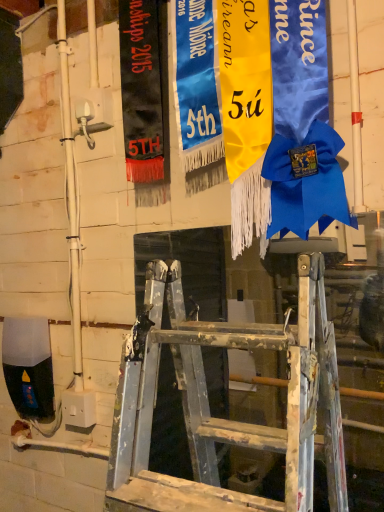
Identify the location of blue satin ribbon at upper center, marked as the 2th tapestry in a right-to-left arrangement. (197, 94).

Is blue satin ribbon at upper center, marked as the second tapestry in a left-to-right arrangement, oriented away from yellow satin ribbon at center, marked as the third tapestry in a left-to-right arrangement?

No.

Is blue satin ribbon at upper center, marked as the 2th tapestry in a right-to-left arrangement, inside the boundaries of yellow satin ribbon at center, which ranks as the first tapestry in right-to-left order, or outside?

blue satin ribbon at upper center, marked as the 2th tapestry in a right-to-left arrangement, is located beyond the bounds of yellow satin ribbon at center, which ranks as the first tapestry in right-to-left order.

From a real-world perspective, is blue satin ribbon at upper center, marked as the 2th tapestry in a right-to-left arrangement, physically below yellow satin ribbon at center, which ranks as the first tapestry in right-to-left order?

No, from a real-world perspective, blue satin ribbon at upper center, marked as the 2th tapestry in a right-to-left arrangement, is not below yellow satin ribbon at center, which ranks as the first tapestry in right-to-left order.

From the picture: From a real-world perspective, between yellow satin ribbon at center, marked as the third tapestry in a left-to-right arrangement, and blue satin ribbon at upper center, marked as the second tapestry in a left-to-right arrangement, who is vertically lower?

yellow satin ribbon at center, marked as the third tapestry in a left-to-right arrangement, is physically lower.

From the image's perspective, between yellow satin ribbon at center, which ranks as the first tapestry in right-to-left order, and blue satin ribbon at upper center, marked as the second tapestry in a left-to-right arrangement, which one is located above?

From the image's view, blue satin ribbon at upper center, marked as the second tapestry in a left-to-right arrangement, is above.

From their relative heights in the image, would you say yellow satin ribbon at center, marked as the third tapestry in a left-to-right arrangement, is taller or shorter than blue satin ribbon at upper center, marked as the second tapestry in a left-to-right arrangement?

Clearly, yellow satin ribbon at center, marked as the third tapestry in a left-to-right arrangement, is taller compared to blue satin ribbon at upper center, marked as the second tapestry in a left-to-right arrangement.

Is blue satin ribbon at upper center, marked as the second tapestry in a left-to-right arrangement, inside yellow satin ribbon at center, marked as the third tapestry in a left-to-right arrangement?

No, blue satin ribbon at upper center, marked as the second tapestry in a left-to-right arrangement, is not inside yellow satin ribbon at center, marked as the third tapestry in a left-to-right arrangement.

Can you confirm if black fabric banner at upper left, marked as the 1th tapestry in a left-to-right arrangement, is positioned to the right of blue satin ribbon at upper center, marked as the 2th tapestry in a right-to-left arrangement?

In fact, black fabric banner at upper left, marked as the 1th tapestry in a left-to-right arrangement, is to the left of blue satin ribbon at upper center, marked as the 2th tapestry in a right-to-left arrangement.

Which is further, (145, 6) or (213, 173)?

The point (213, 173) is behind.

Are black fabric banner at upper left, marked as the 1th tapestry in a left-to-right arrangement, and blue satin ribbon at upper center, marked as the second tapestry in a left-to-right arrangement, beside each other?

They are not placed beside each other.

Does yellow satin ribbon at center, which ranks as the first tapestry in right-to-left order, have a lesser width compared to black fabric banner at upper left, marked as the 1th tapestry in a left-to-right arrangement?

Incorrect, the width of yellow satin ribbon at center, which ranks as the first tapestry in right-to-left order, is not less than that of black fabric banner at upper left, marked as the 1th tapestry in a left-to-right arrangement.

From the image's perspective, which is above, yellow satin ribbon at center, which ranks as the first tapestry in right-to-left order, or black fabric banner at upper left, arranged as the 3th tapestry when viewed from the right?

black fabric banner at upper left, arranged as the 3th tapestry when viewed from the right.

In terms of height, does yellow satin ribbon at center, marked as the third tapestry in a left-to-right arrangement, look taller or shorter compared to black fabric banner at upper left, marked as the 1th tapestry in a left-to-right arrangement?

In the image, yellow satin ribbon at center, marked as the third tapestry in a left-to-right arrangement, appears to be taller than black fabric banner at upper left, marked as the 1th tapestry in a left-to-right arrangement.

Is blue satin ribbon at upper center, marked as the second tapestry in a left-to-right arrangement, looking in the opposite direction of black fabric banner at upper left, arranged as the 3th tapestry when viewed from the right?

No, blue satin ribbon at upper center, marked as the second tapestry in a left-to-right arrangement, is not facing away from black fabric banner at upper left, arranged as the 3th tapestry when viewed from the right.

In the image, is blue satin ribbon at upper center, marked as the 2th tapestry in a right-to-left arrangement, positioned in front of or behind black fabric banner at upper left, marked as the 1th tapestry in a left-to-right arrangement?

Clearly, blue satin ribbon at upper center, marked as the 2th tapestry in a right-to-left arrangement, is in front of black fabric banner at upper left, marked as the 1th tapestry in a left-to-right arrangement.

Is blue satin ribbon at upper center, marked as the second tapestry in a left-to-right arrangement, next to black fabric banner at upper left, arranged as the 3th tapestry when viewed from the right, and touching it?

They are not placed beside each other.

Does blue satin ribbon at upper center, marked as the second tapestry in a left-to-right arrangement, have a lesser width compared to black fabric banner at upper left, arranged as the 3th tapestry when viewed from the right?

No.

How much distance is there between black fabric banner at upper left, marked as the 1th tapestry in a left-to-right arrangement, and yellow satin ribbon at center, marked as the third tapestry in a left-to-right arrangement?

black fabric banner at upper left, marked as the 1th tapestry in a left-to-right arrangement, is 8.10 inches from yellow satin ribbon at center, marked as the third tapestry in a left-to-right arrangement.

Can you confirm if black fabric banner at upper left, marked as the 1th tapestry in a left-to-right arrangement, is taller than yellow satin ribbon at center, which ranks as the first tapestry in right-to-left order?

Incorrect, the height of black fabric banner at upper left, marked as the 1th tapestry in a left-to-right arrangement, is not larger of that of yellow satin ribbon at center, which ranks as the first tapestry in right-to-left order.

From the image's perspective, which is below, black fabric banner at upper left, arranged as the 3th tapestry when viewed from the right, or yellow satin ribbon at center, which ranks as the first tapestry in right-to-left order?

yellow satin ribbon at center, which ranks as the first tapestry in right-to-left order.

Consider the image. Is black fabric banner at upper left, marked as the 1th tapestry in a left-to-right arrangement, inside or outside of yellow satin ribbon at center, which ranks as the first tapestry in right-to-left order?

black fabric banner at upper left, marked as the 1th tapestry in a left-to-right arrangement, lies outside yellow satin ribbon at center, which ranks as the first tapestry in right-to-left order.

Find the location of a particular element. This screenshot has width=384, height=512. the 1st tapestry behind the yellow satin ribbon at center, marked as the third tapestry in a left-to-right arrangement is located at coordinates (197, 94).

Locate an element on the screen. the 1st tapestry positioned above the yellow satin ribbon at center, marked as the third tapestry in a left-to-right arrangement (from the image's perspective) is located at coordinates (197, 94).

From the image, which object appears to be nearer to blue satin ribbon at upper center, marked as the 2th tapestry in a right-to-left arrangement, black fabric banner at upper left, marked as the 1th tapestry in a left-to-right arrangement, or yellow satin ribbon at center, which ranks as the first tapestry in right-to-left order?

yellow satin ribbon at center, which ranks as the first tapestry in right-to-left order, lies closer to blue satin ribbon at upper center, marked as the 2th tapestry in a right-to-left arrangement, than the other object.

When comparing their distances from yellow satin ribbon at center, marked as the third tapestry in a left-to-right arrangement, does blue satin ribbon at upper center, marked as the second tapestry in a left-to-right arrangement, or black fabric banner at upper left, arranged as the 3th tapestry when viewed from the right, seem further?

black fabric banner at upper left, arranged as the 3th tapestry when viewed from the right.

Looking at this image, considering their positions, is yellow satin ribbon at center, which ranks as the first tapestry in right-to-left order, positioned further to black fabric banner at upper left, marked as the 1th tapestry in a left-to-right arrangement, than blue satin ribbon at upper center, marked as the second tapestry in a left-to-right arrangement?

yellow satin ribbon at center, which ranks as the first tapestry in right-to-left order, lies further to black fabric banner at upper left, marked as the 1th tapestry in a left-to-right arrangement, than the other object.

Looking at this image, based on their spatial positions, is yellow satin ribbon at center, marked as the third tapestry in a left-to-right arrangement, or black fabric banner at upper left, marked as the 1th tapestry in a left-to-right arrangement, further from blue satin ribbon at upper center, marked as the 2th tapestry in a right-to-left arrangement?

Among the two, black fabric banner at upper left, marked as the 1th tapestry in a left-to-right arrangement, is located further to blue satin ribbon at upper center, marked as the 2th tapestry in a right-to-left arrangement.

Looking at the image, which one is located closer to yellow satin ribbon at center, which ranks as the first tapestry in right-to-left order, black fabric banner at upper left, arranged as the 3th tapestry when viewed from the right, or blue satin ribbon at upper center, marked as the 2th tapestry in a right-to-left arrangement?

Based on the image, blue satin ribbon at upper center, marked as the 2th tapestry in a right-to-left arrangement, appears to be nearer to yellow satin ribbon at center, which ranks as the first tapestry in right-to-left order.

When comparing their distances from black fabric banner at upper left, marked as the 1th tapestry in a left-to-right arrangement, does blue satin ribbon at upper center, marked as the second tapestry in a left-to-right arrangement, or yellow satin ribbon at center, which ranks as the first tapestry in right-to-left order, seem further?

The object further to black fabric banner at upper left, marked as the 1th tapestry in a left-to-right arrangement, is yellow satin ribbon at center, which ranks as the first tapestry in right-to-left order.

The height and width of the screenshot is (512, 384). Find the location of `tapestry situated between black fabric banner at upper left, arranged as the 3th tapestry when viewed from the right, and yellow satin ribbon at center, which ranks as the first tapestry in right-to-left order, from left to right`. tapestry situated between black fabric banner at upper left, arranged as the 3th tapestry when viewed from the right, and yellow satin ribbon at center, which ranks as the first tapestry in right-to-left order, from left to right is located at coordinates [197, 94].